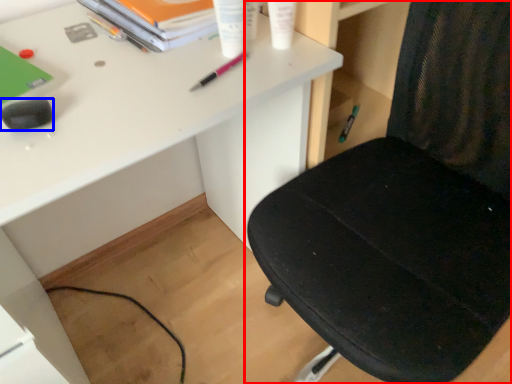
Question: Among these objects, which one is farthest to the camera, chair (highlighted by a red box) or stationery (highlighted by a blue box)?

Choices:
 (A) chair
 (B) stationery

Answer: (B)